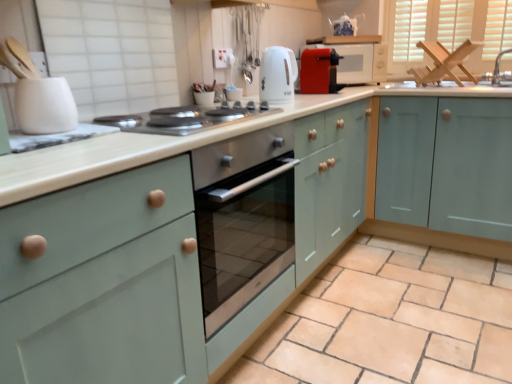
The height and width of the screenshot is (384, 512). I want to click on vacant region to the right of white matte cup at upper left, acting as the 1th kitchen appliance starting from the left, so click(114, 137).